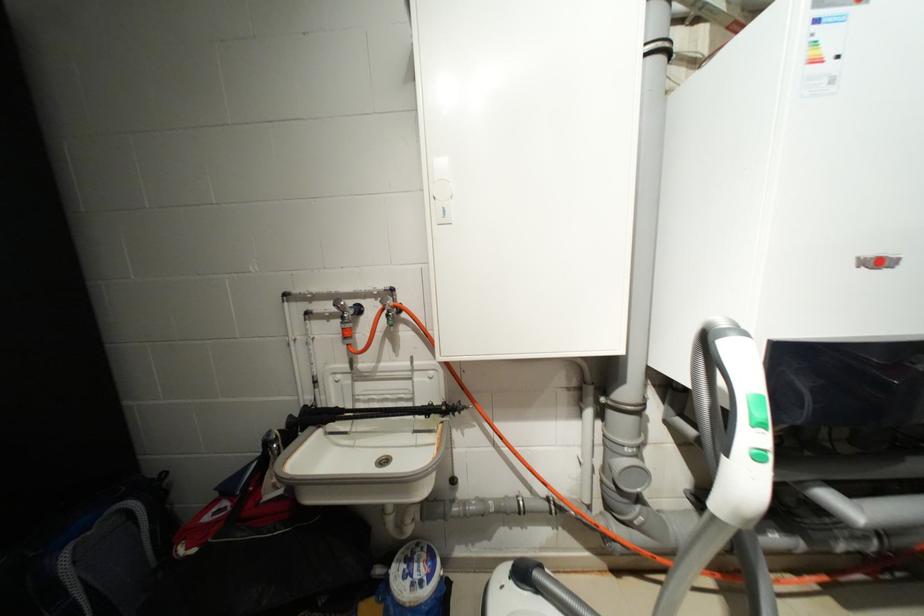
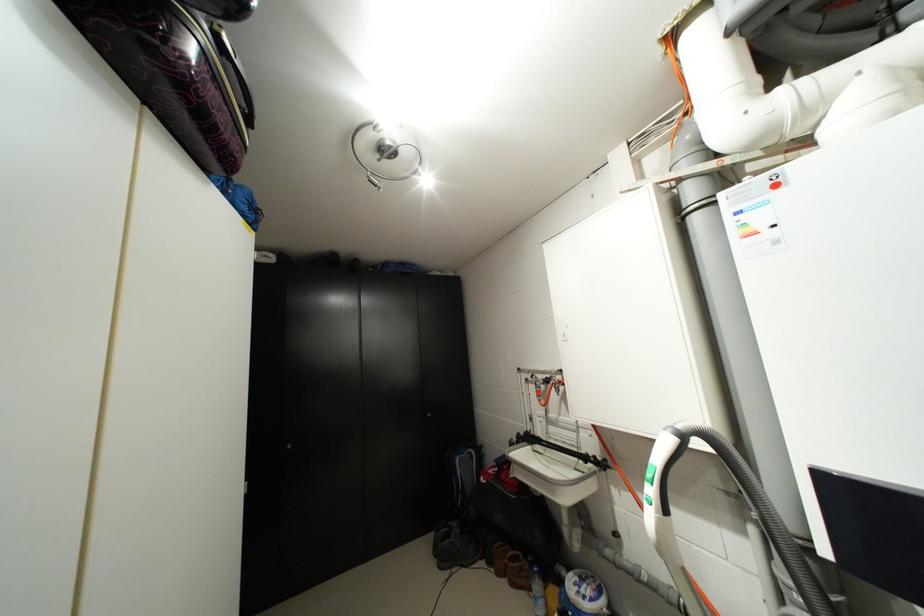
The point at (436, 578) is marked in the first image. Where is the corresponding point in the second image?

(599, 600)